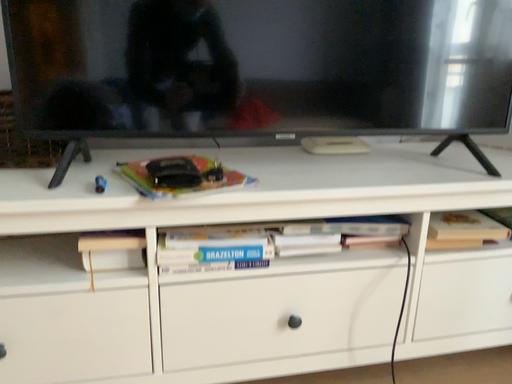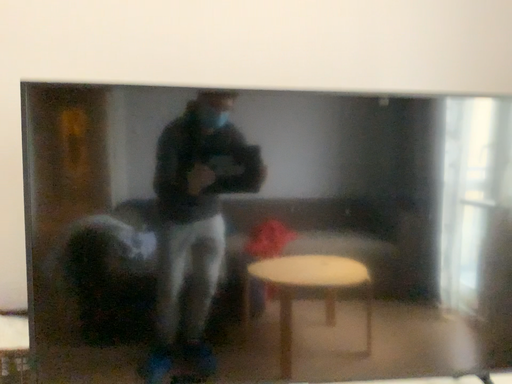
Question: How did the camera likely rotate when shooting the video?

Choices:
 (A) rotated downward
 (B) rotated upward

Answer: (B)